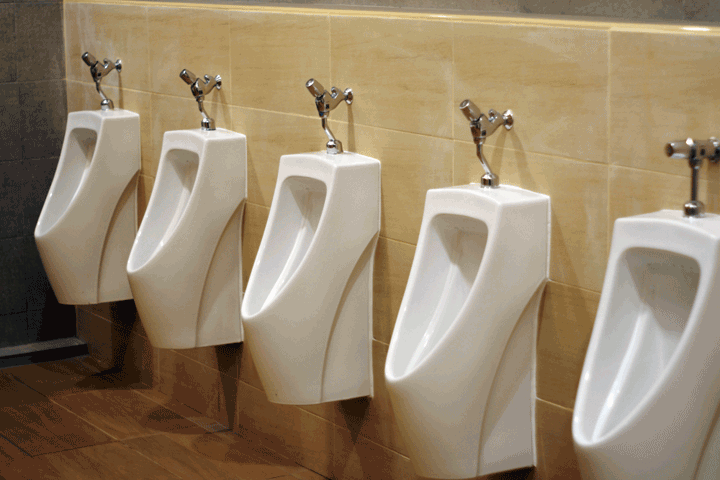
The width and height of the screenshot is (720, 480). I want to click on urinals, so click(x=83, y=174), click(x=196, y=195), click(x=330, y=242), click(x=490, y=258), click(x=649, y=317).